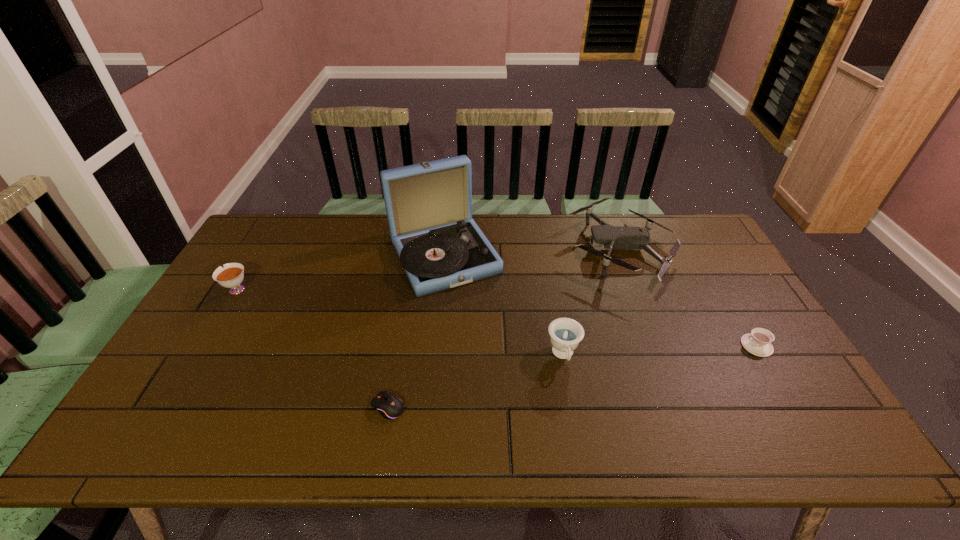
The height and width of the screenshot is (540, 960). In order to click on free space located 0.220m on the front-facing side of the drone in this screenshot , I will do `click(502, 249)`.

Locate an element on the screen. This screenshot has height=540, width=960. free point located on the front-facing side of the drone is located at coordinates [x=482, y=249].

The width and height of the screenshot is (960, 540). Identify the location of vacant area situated on the front-facing side of the drone. (523, 249).

Identify the location of vacant space situated 0.160m on the side of the second teacup from right to left with the handle. Image resolution: width=960 pixels, height=540 pixels. (577, 432).

This screenshot has height=540, width=960. I want to click on vacant region located on the handle side of the shortest teacup, so click(x=712, y=346).

Identify the location of vacant point located 0.080m on the handle side of the shortest teacup. (712, 346).

Where is `free point located on the handle side of the shortest teacup`? The height and width of the screenshot is (540, 960). free point located on the handle side of the shortest teacup is located at coordinates (667, 346).

Where is `vacant space located 0.250m on the left of the computer mouse`? This screenshot has width=960, height=540. vacant space located 0.250m on the left of the computer mouse is located at coordinates (266, 407).

You are a GUI agent. You are given a task and a screenshot of the screen. Output one action in this format:
    pyautogui.click(x=<x>, y=<y>)
    Task: Click on the phonograph record that is at the far edge
    The width and height of the screenshot is (960, 540).
    Given the screenshot: What is the action you would take?
    pyautogui.click(x=429, y=205)

Where is `drone that is at the far edge`? Image resolution: width=960 pixels, height=540 pixels. drone that is at the far edge is located at coordinates (611, 237).